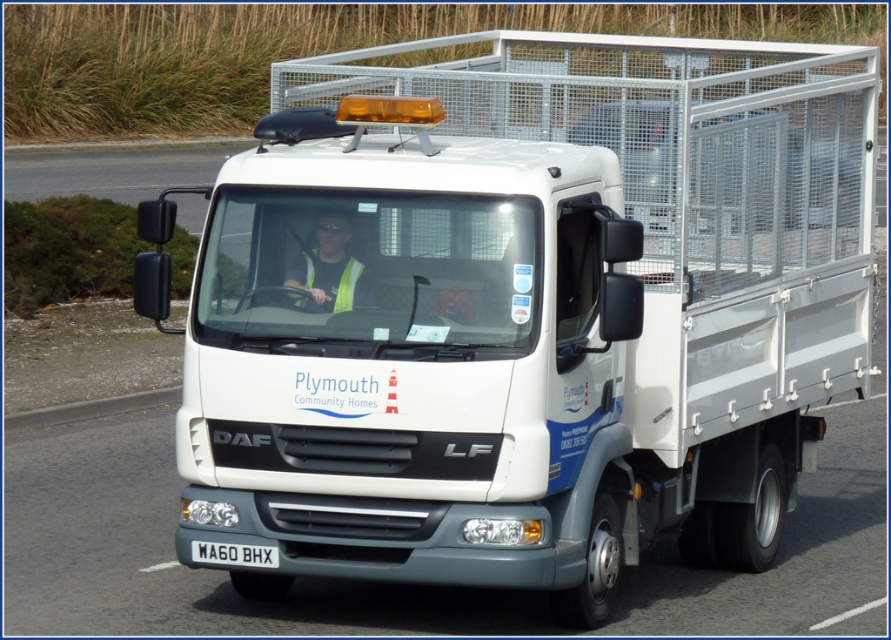
What do you see at coordinates (330, 269) in the screenshot?
I see `yellow reflective vest at center` at bounding box center [330, 269].

Who is positioned more to the left, yellow reflective vest at center or yellow reflective safety vest at center?

yellow reflective safety vest at center is more to the left.

At what (x,y) coordinates should I click in order to perform the action: click on yellow reflective vest at center. Please return your answer as a coordinate pair (x, y). The image size is (891, 640). Looking at the image, I should click on (330, 269).

This screenshot has width=891, height=640. I want to click on yellow reflective vest at center, so click(x=330, y=269).

From the picture: Is yellow reflective vest at center further to camera compared to white plastic license plate at center?

That is False.

Image resolution: width=891 pixels, height=640 pixels. Identify the location of yellow reflective vest at center. (330, 269).

Looking at this image, can you confirm if white plastic license plate at center is smaller than yellow reflective safety vest at center?

Yes, white plastic license plate at center is smaller than yellow reflective safety vest at center.

Which is more to the left, white plastic license plate at center or yellow reflective safety vest at center?

From the viewer's perspective, white plastic license plate at center appears more on the left side.

Between point (211, 560) and point (342, 298), which one is positioned behind?

Positioned behind is point (211, 560).

Image resolution: width=891 pixels, height=640 pixels. What are the coordinates of `white plastic license plate at center` in the screenshot? It's located at (234, 554).